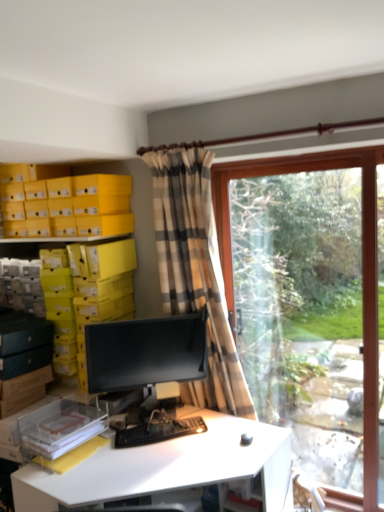
I want to click on free location in front of black matte keyboard at center, so 150,464.